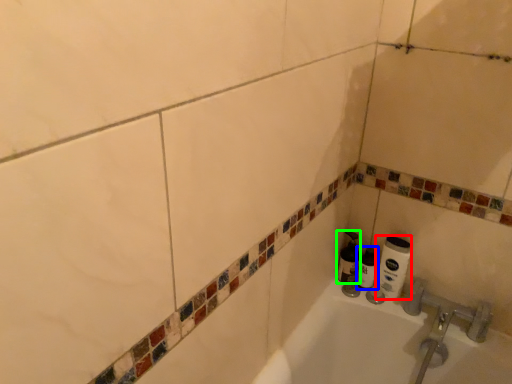
Question: Which object is positioned closest to toilet paper (highlighted by a red box)? Select from shaving cream (highlighted by a blue box) and shaving cream (highlighted by a green box).

Choices:
 (A) shaving cream
 (B) shaving cream

Answer: (A)